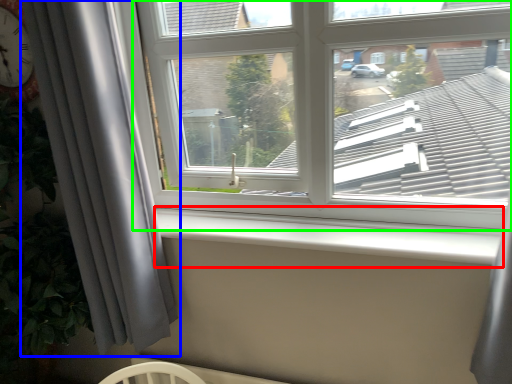
Question: Estimate the real-world distances between objects in this image. Which object is farther from window sill (highlighted by a red box), curtain (highlighted by a blue box) or window (highlighted by a green box)?

Choices:
 (A) curtain
 (B) window

Answer: (A)